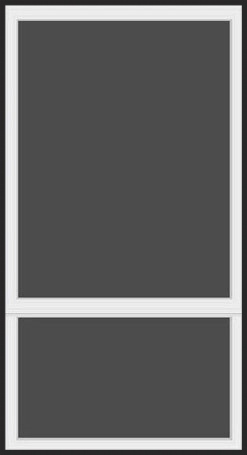
Find the location of a particular element. The width and height of the screenshot is (247, 455). frame edge is located at coordinates (18, 380), (127, 437), (124, 318), (230, 390), (230, 259), (121, 298), (18, 221), (124, 21).